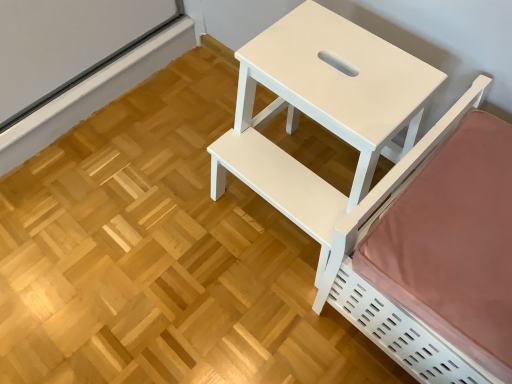
Question: In terms of height, does white matte table at center look taller or shorter compared to white matte bed at right?

Choices:
 (A) short
 (B) tall

Answer: (B)

Question: From the image's perspective, is white matte table at center positioned above or below white matte bed at right?

Choices:
 (A) above
 (B) below

Answer: (A)

Question: Based on their sizes in the image, would you say white matte table at center is bigger or smaller than white matte bed at right?

Choices:
 (A) small
 (B) big

Answer: (A)

Question: From the image's perspective, relative to white matte table at center, is white matte bed at right above or below?

Choices:
 (A) above
 (B) below

Answer: (B)

Question: Is point (412, 160) positioned closer to the camera than point (391, 57)?

Choices:
 (A) closer
 (B) farther

Answer: (A)

Question: From their relative heights in the image, would you say white matte bed at right is taller or shorter than white matte table at center?

Choices:
 (A) short
 (B) tall

Answer: (A)

Question: From a real-world perspective, is white matte bed at right above or below white matte table at center?

Choices:
 (A) below
 (B) above

Answer: (A)